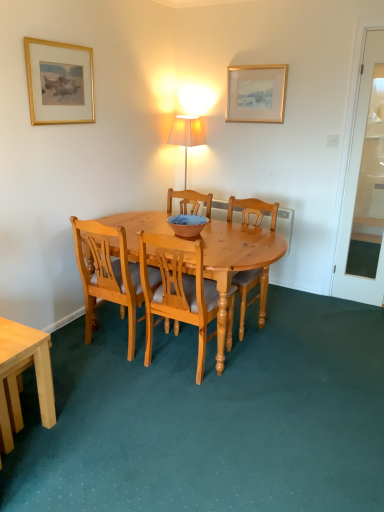
The width and height of the screenshot is (384, 512). Identify the location of free location in front of light brown wood chair at center, the third chair in the right-to-left sequence. (114, 382).